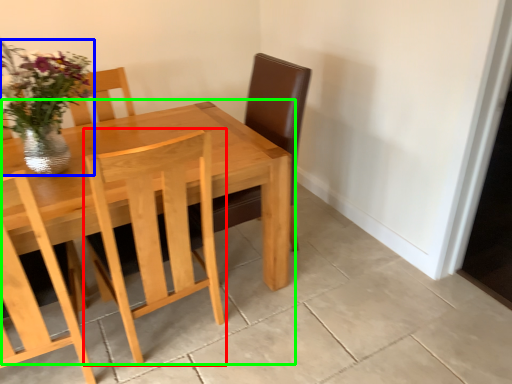
Question: Which is farther away from chair (highlighted by a red box)? floral arrangement (highlighted by a blue box) or kitchen & dining room table (highlighted by a green box)?

Choices:
 (A) floral arrangement
 (B) kitchen & dining room table

Answer: (A)